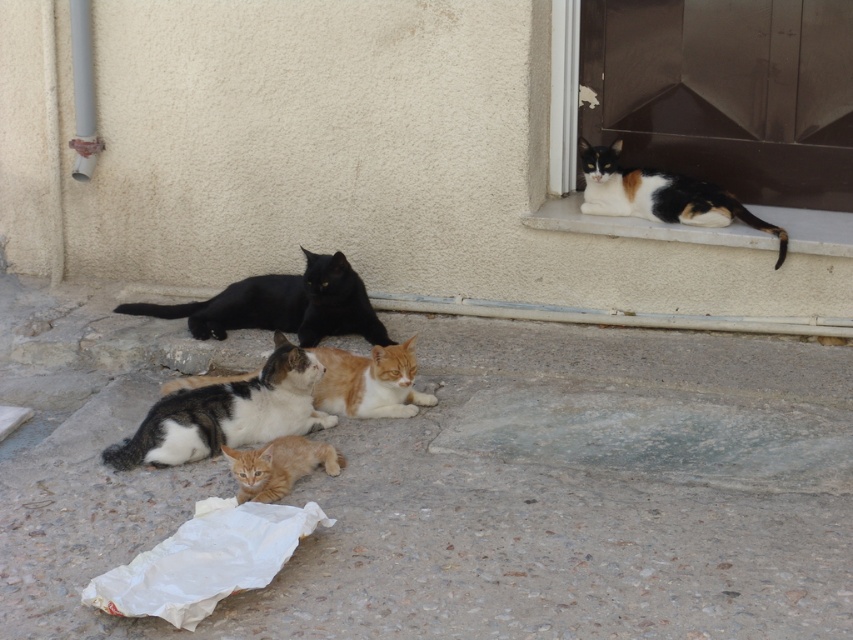
Question: Based on their relative distances, which object is farther from the orange fur cat at lower center?

Choices:
 (A) orange and white fur at center
 (B) calico fur cat at upper right

Answer: (B)

Question: Which object appears closest to the camera in this image?

Choices:
 (A) calico fur cat at upper right
 (B) black matte cat at center
 (C) orange fur cat at lower center
 (D) calico fur cat at center

Answer: (C)

Question: Does metallic door at upper right have a smaller size compared to orange fur cat at lower center?

Choices:
 (A) no
 (B) yes

Answer: (A)

Question: Is calico fur cat at upper right closer to camera compared to orange and white fur at center?

Choices:
 (A) no
 (B) yes

Answer: (A)

Question: Is metallic door at upper right above orange fur cat at lower center?

Choices:
 (A) yes
 (B) no

Answer: (A)

Question: Which point is closer to the camera taking this photo?

Choices:
 (A) coord(593,173)
 (B) coord(276,440)

Answer: (B)